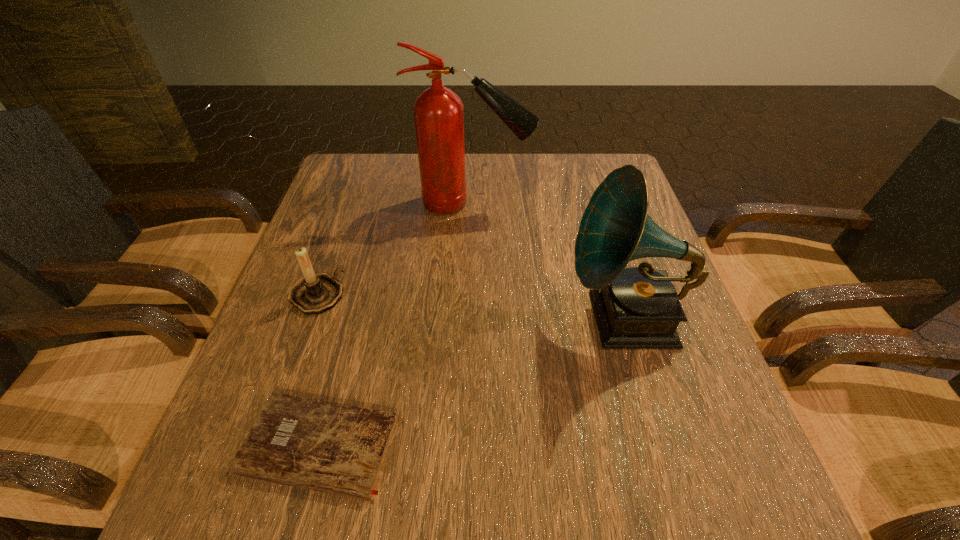
Identify the location of vacant region at the near edge of the desktop. The height and width of the screenshot is (540, 960). (517, 486).

At what (x,y) coordinates should I click in order to perform the action: click on free space at the left edge of the desktop. Please return your answer as a coordinate pair (x, y). Image resolution: width=960 pixels, height=540 pixels. Looking at the image, I should click on [339, 243].

In the image, there is a desktop. Identify the location of free region at the right edge. The height and width of the screenshot is (540, 960). (660, 380).

Locate an element on the screen. The image size is (960, 540). vacant space at the near left corner is located at coordinates (196, 523).

In the image, there is a desktop. Identify the location of free space at the far right corner. This screenshot has width=960, height=540. (x=596, y=189).

I want to click on vacant space at the near right corner, so click(729, 478).

The image size is (960, 540). I want to click on vacant area that lies between the Bible and the farthest object, so click(x=396, y=324).

What are the coordinates of `unoccupied position between the shortest object and the third tallest object` in the screenshot? It's located at (318, 370).

Find the location of `empty space that is in between the candle holder and the phonograph_record`. empty space that is in between the candle holder and the phonograph_record is located at coordinates (471, 307).

Locate an element on the screen. empty space that is in between the second tallest object and the third tallest object is located at coordinates (471, 307).